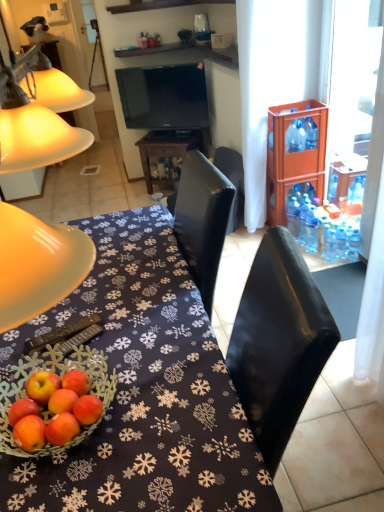
Question: Is blue plastic bottle at right, the 3th bottle ordered from the bottom, taller or shorter than black leather chair at center?

Choices:
 (A) tall
 (B) short

Answer: (B)

Question: From the image's perspective, is blue plastic bottle at right, the 2th bottle in the right-to-left sequence, positioned above or below black leather chair at center?

Choices:
 (A) above
 (B) below

Answer: (A)

Question: Which of these objects is positioned closest to the clear plastic bottle at right, marked as the 3th bottle in a left-to-right arrangement?

Choices:
 (A) blue plastic bottle at right, the 3th bottle ordered from the bottom
 (B) black glossy television at upper center
 (C) black glossy table at center
 (D) matte yellow lampshade at left
 (E) brown fabric table at center

Answer: (A)

Question: Which object is the closest to the clear plastic bottle at right, acting as the third bottle starting from the right?

Choices:
 (A) black glossy table at center
 (B) black leather chair at center
 (C) black matte remote control at lower left
 (D) blue plastic bottle at right, which appears as the 1th bottle when viewed from the top
 (E) black glossy television at upper center

Answer: (D)